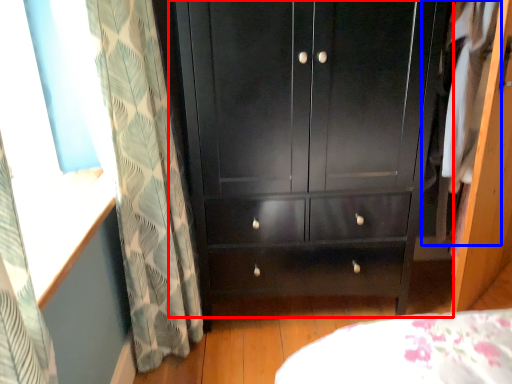
Question: Which of the following is the farthest to the observer, cupboard (highlighted by a red box) or clothing (highlighted by a blue box)?

Choices:
 (A) cupboard
 (B) clothing

Answer: (B)